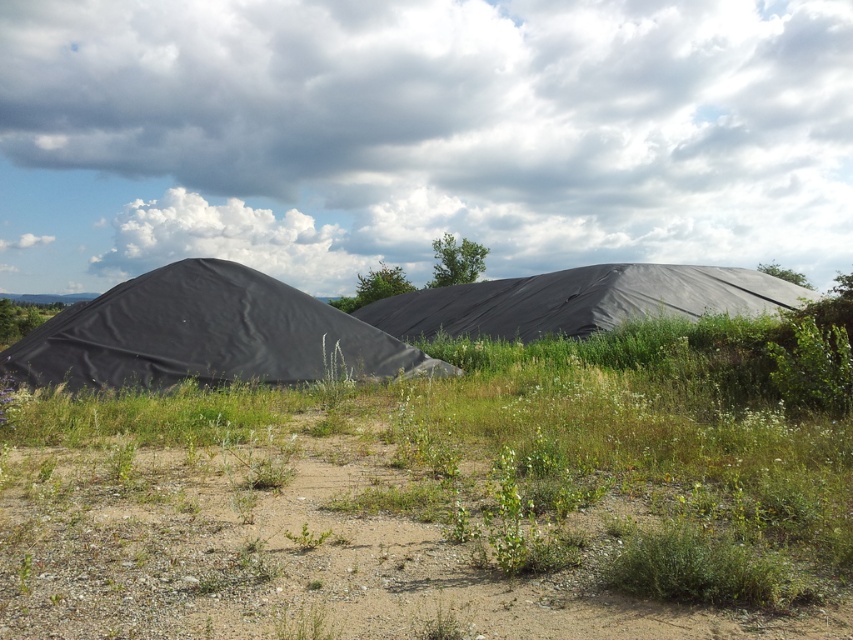
Question: Does black matte tent at left appear on the right side of black tarp at center?

Choices:
 (A) no
 (B) yes

Answer: (A)

Question: Which of the following is the farthest from the observer?

Choices:
 (A) (744, 308)
 (B) (361, 368)

Answer: (A)

Question: Is black matte tent at left bigger than black tarp at center?

Choices:
 (A) yes
 (B) no

Answer: (B)

Question: Which point is farther to the camera?

Choices:
 (A) (546, 305)
 (B) (106, 372)

Answer: (A)

Question: Does black matte tent at left appear on the right side of black tarp at center?

Choices:
 (A) no
 (B) yes

Answer: (A)